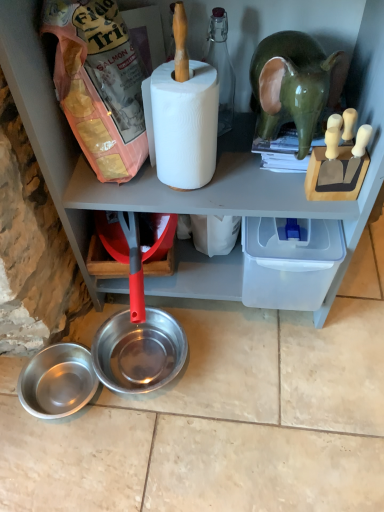
Identify the location of free space in front of brushed metal bowl at lower left, the 1th bowl positioned from the left. (66, 466).